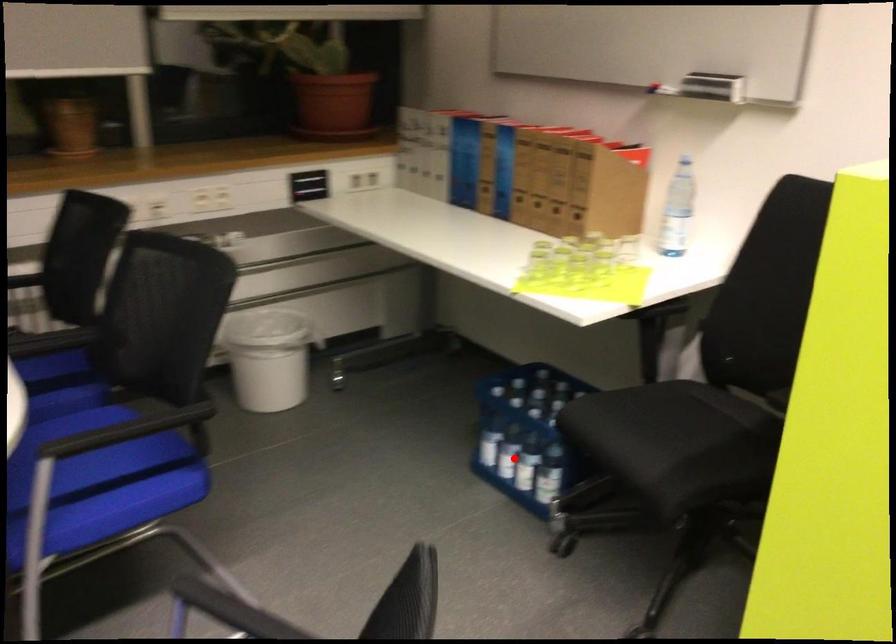
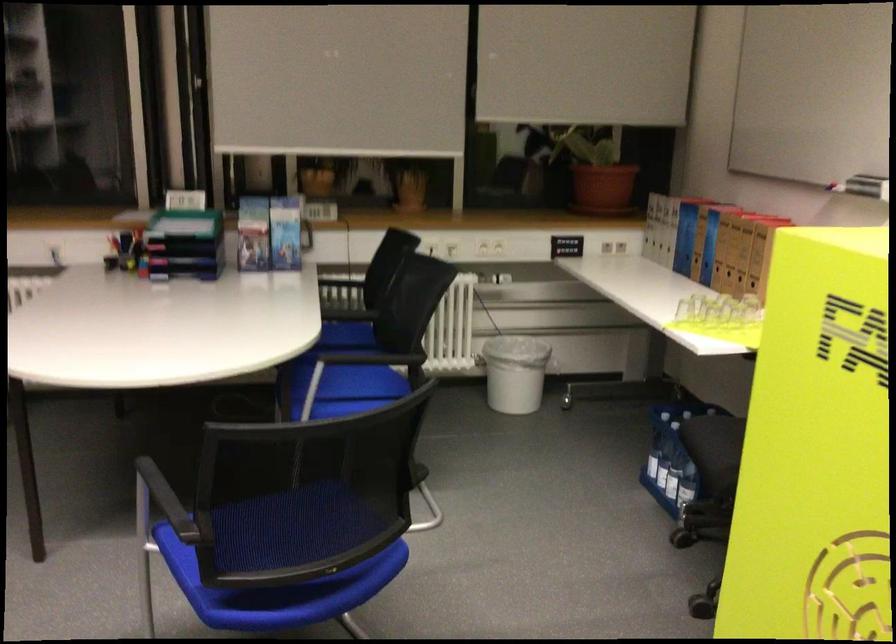
Question: I am providing you with two images of the same scene from different viewpoints. In image1, a red point is highlighted. Considering the same 3D point in image2, which of the following is correct?

Choices:
 (A) It is closer
 (B) It is farther

Answer: (B)